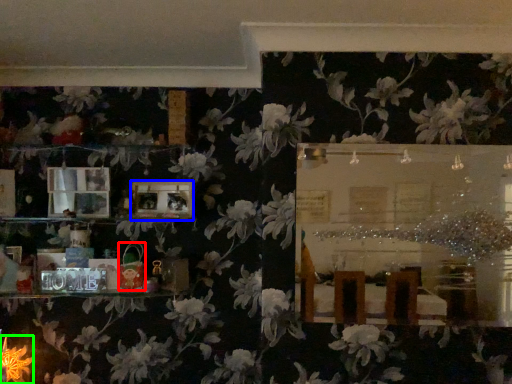
Question: Which object is the closest to the toy (highlighted by a red box)? Choose among these: picture frame (highlighted by a blue box) or flower (highlighted by a green box).

Choices:
 (A) picture frame
 (B) flower

Answer: (A)